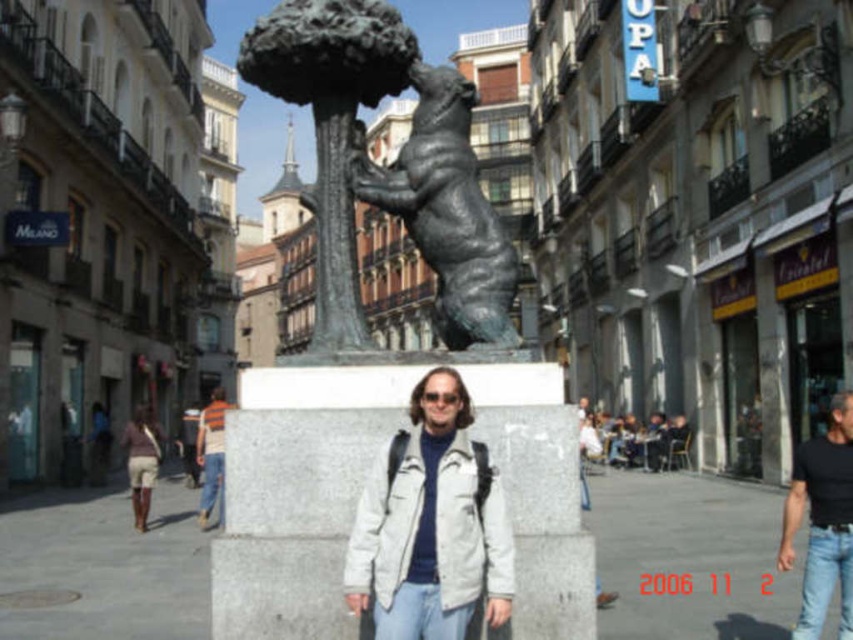
Question: Is light gray fabric jacket at center to the left of bronze bear at center from the viewer's perspective?

Choices:
 (A) yes
 (B) no

Answer: (B)

Question: Considering the real-world distances, which object is closest to the beige shorts at lower left?

Choices:
 (A) light gray fabric jacket at center
 (B) black cotton shirt at lower right
 (C) striped shirt at center

Answer: (C)

Question: Is light gray fabric jacket at center further to camera compared to black cotton shirt at lower right?

Choices:
 (A) yes
 (B) no

Answer: (B)

Question: Which object appears closest to the camera in this image?

Choices:
 (A) bronze bear at center
 (B) beige shorts at lower left
 (C) striped shirt at center
 (D) light gray fabric jacket at center

Answer: (D)

Question: Estimate the real-world distances between objects in this image. Which object is closer to the light gray fabric jacket at center?

Choices:
 (A) black cotton shirt at lower right
 (B) bronze bear at center
 (C) beige shorts at lower left
 (D) striped shirt at center

Answer: (B)

Question: Does light gray fabric jacket at center have a smaller size compared to black cotton shirt at lower right?

Choices:
 (A) yes
 (B) no

Answer: (A)